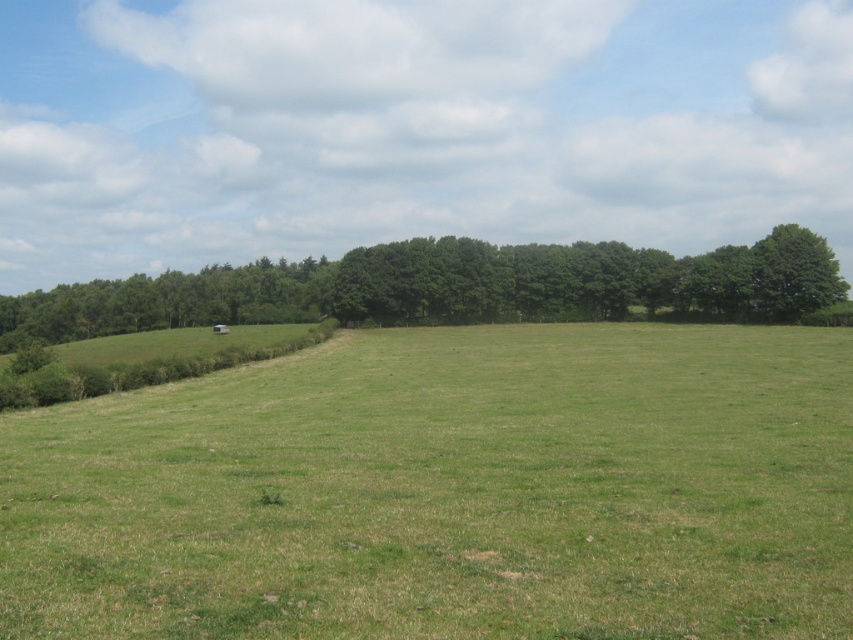
In the scene shown: Is green grass pasture at center above green leafy tree at right?

No.

Can you confirm if green grass pasture at center is wider than green leafy tree at right?

Correct, the width of green grass pasture at center exceeds that of green leafy tree at right.

Is point (814, 371) positioned after point (793, 259)?

No, it is not.

This screenshot has height=640, width=853. In order to click on green grass pasture at center in this screenshot , I will do `click(448, 490)`.

Which of these two, green leafy trees at center or green leafy tree at right, stands taller?

With more height is green leafy trees at center.

This screenshot has width=853, height=640. I want to click on green leafy trees at center, so click(x=445, y=288).

Identify the location of green leafy trees at center. (445, 288).

Between point (605, 417) and point (460, 289), which one is positioned behind?

The point (460, 289) is behind.

I want to click on green grass pasture at center, so click(448, 490).